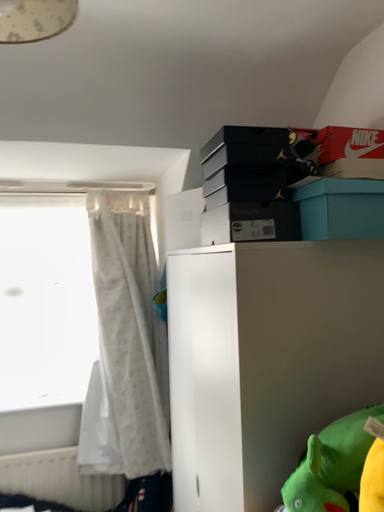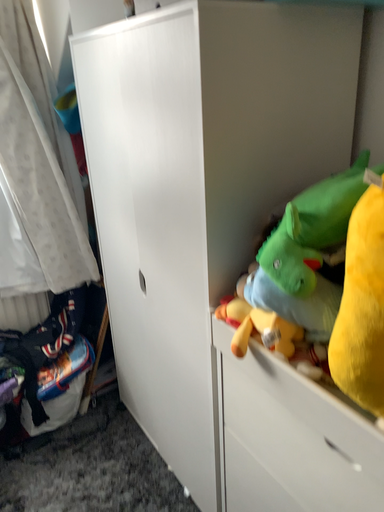
Question: How did the camera likely rotate when shooting the video?

Choices:
 (A) rotated upward
 (B) rotated downward

Answer: (B)